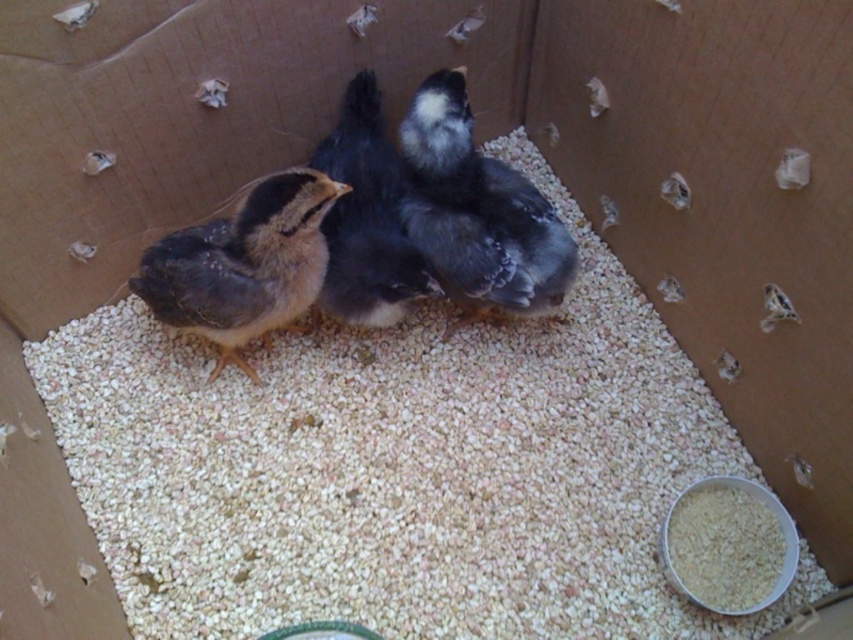
Question: Does silvery gray feathers at center come behind black feathered chick at center?

Choices:
 (A) no
 (B) yes

Answer: (A)

Question: Among these points, which one is farthest from the camera?

Choices:
 (A) (442, 179)
 (B) (320, 218)
 (C) (368, 188)
 (D) (752, 573)

Answer: (C)

Question: Which point is closer to the camera?

Choices:
 (A) black feathered chick at center
 (B) white grain at lower right

Answer: (B)

Question: Which of the following is the farthest from the observer?

Choices:
 (A) (184, 320)
 (B) (773, 563)

Answer: (A)

Question: From the image, what is the correct spatial relationship of black feathered chick at center in relation to white grain at lower right?

Choices:
 (A) left
 (B) right

Answer: (A)

Question: Is soft yellow down at center positioned before black feathered chick at center?

Choices:
 (A) no
 (B) yes

Answer: (B)